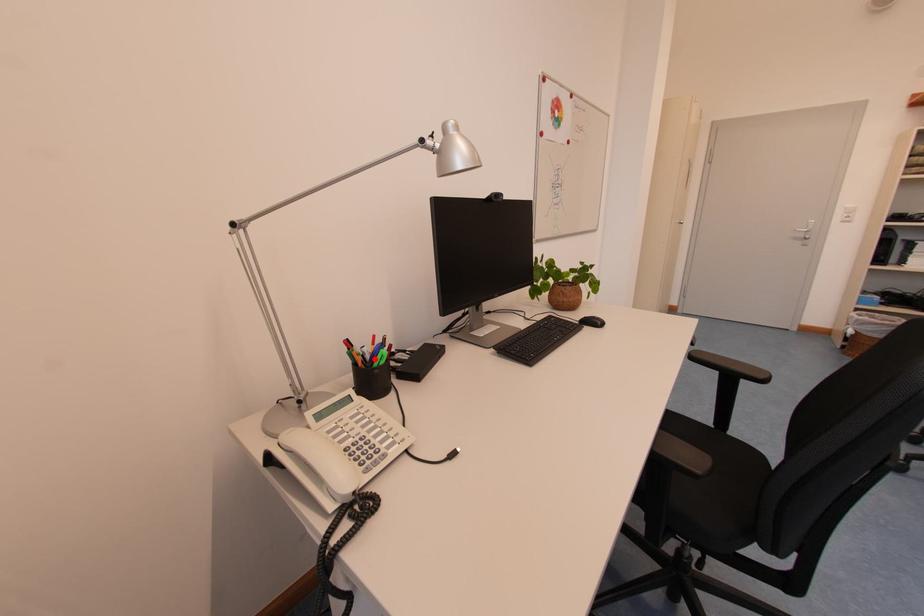
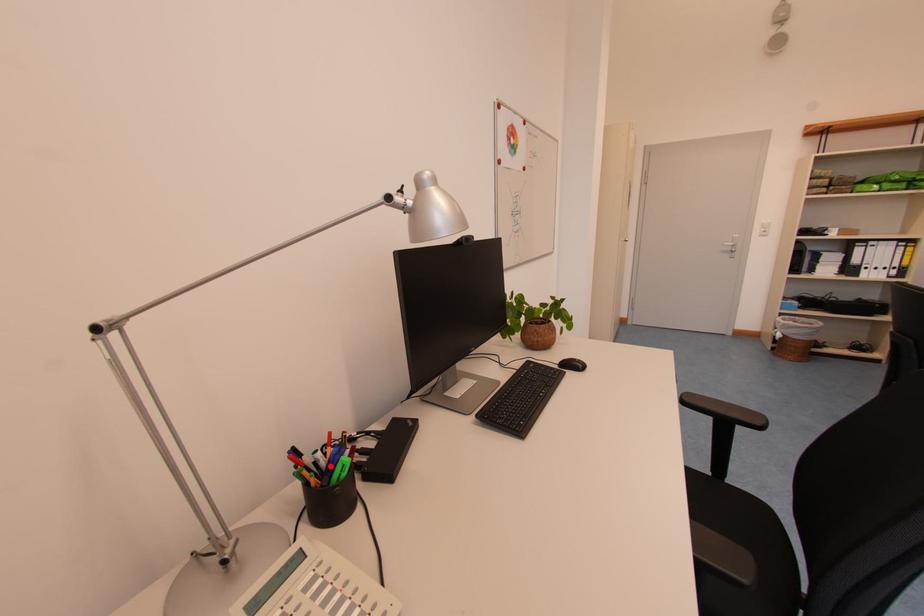
I am providing you with two images of the same scene from different viewpoints. A red point is marked on the first image and another point is marked on the second image. Does the point marked in image1 correspond to the same location as the one in image2?

Yes